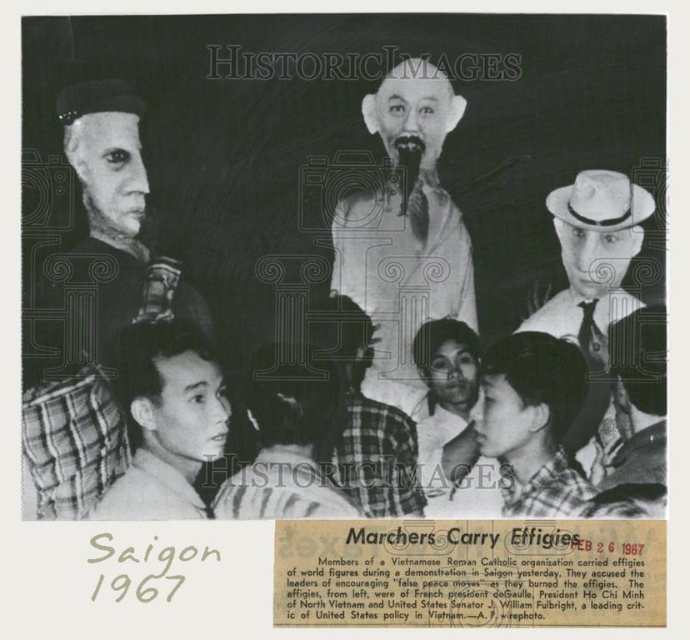
Based on the photo, is plaid shirt at lower left positioned before smooth leather hat at upper right?

Yes, plaid shirt at lower left is closer to the viewer.

Which is more to the left, plaid shirt at lower left or smooth leather hat at upper right?

plaid shirt at lower left

Find the location of a particular element. plaid shirt at lower left is located at coordinates (166, 420).

How much distance is there between smooth white statue at upper center and plaid shirt at lower left?

smooth white statue at upper center is 11.40 inches from plaid shirt at lower left.

Is point (593, 340) positioned in front of point (147, 422)?

No, (593, 340) is behind (147, 422).

Locate an element on the screen. The height and width of the screenshot is (640, 690). smooth white statue at upper center is located at coordinates (342, 288).

The height and width of the screenshot is (640, 690). Find the location of `smooth white statue at upper center`. smooth white statue at upper center is located at coordinates (342, 288).

Does white matte figure at center come in front of white felt hat at upper right?

No.

Does white matte figure at center have a greater width compared to white felt hat at upper right?

Indeed, white matte figure at center has a greater width compared to white felt hat at upper right.

Between point (331, 234) and point (638, 422), which one is positioned in front?

Positioned in front is point (638, 422).

Identify the location of white matte figure at center. (404, 234).